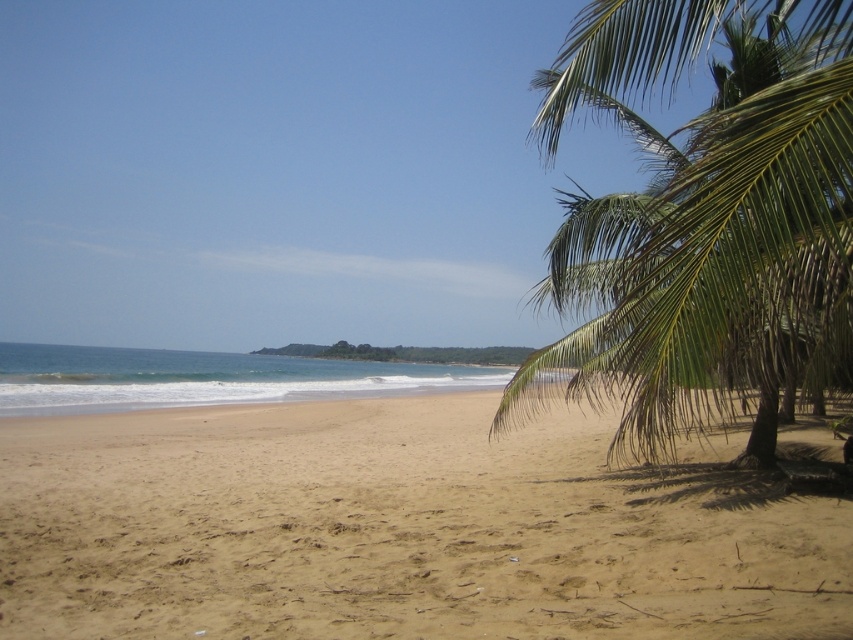
Question: Is light brown sand at lower center further to the viewer compared to green leafy palm tree at right?

Choices:
 (A) yes
 (B) no

Answer: (A)

Question: Where is light brown sand at lower center located in relation to green leafy palm tree at right in the image?

Choices:
 (A) left
 (B) right

Answer: (A)

Question: Does light brown sand at lower center have a lesser width compared to green leafy palm tree at right?

Choices:
 (A) no
 (B) yes

Answer: (B)

Question: Which object appears farthest from the camera in this image?

Choices:
 (A) light brown sand at lower center
 (B) green leafy palm tree at right

Answer: (A)